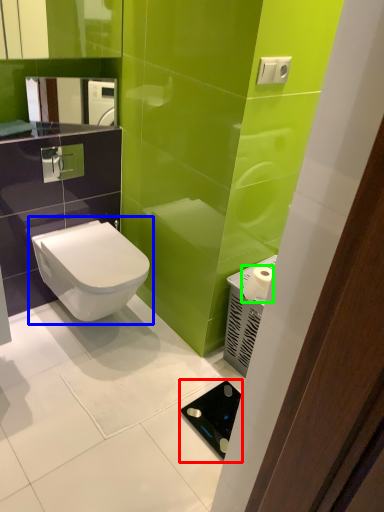
Question: Which object is positioned farthest from appliance (highlighted by a red box)? Select from toilet (highlighted by a blue box) and toilet paper (highlighted by a green box).

Choices:
 (A) toilet
 (B) toilet paper

Answer: (A)